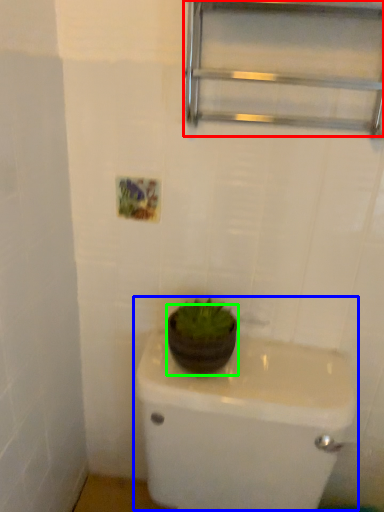
Question: Which object is positioned closest to shelf (highlighted by a red box)? Select from sink (highlighted by a blue box) and flowerpot (highlighted by a green box).

Choices:
 (A) sink
 (B) flowerpot

Answer: (B)